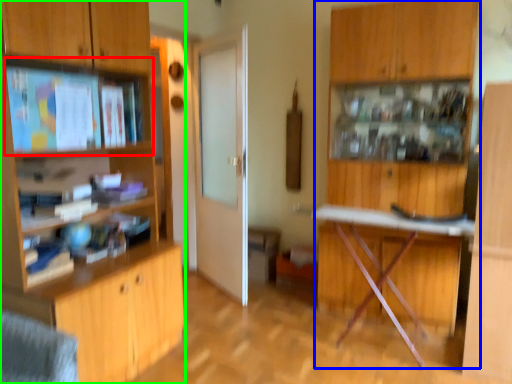
Question: Which is nearer to the shelf (highlighted by a red box)? dresser (highlighted by a blue box) or cabinetry (highlighted by a green box).

Choices:
 (A) dresser
 (B) cabinetry

Answer: (B)